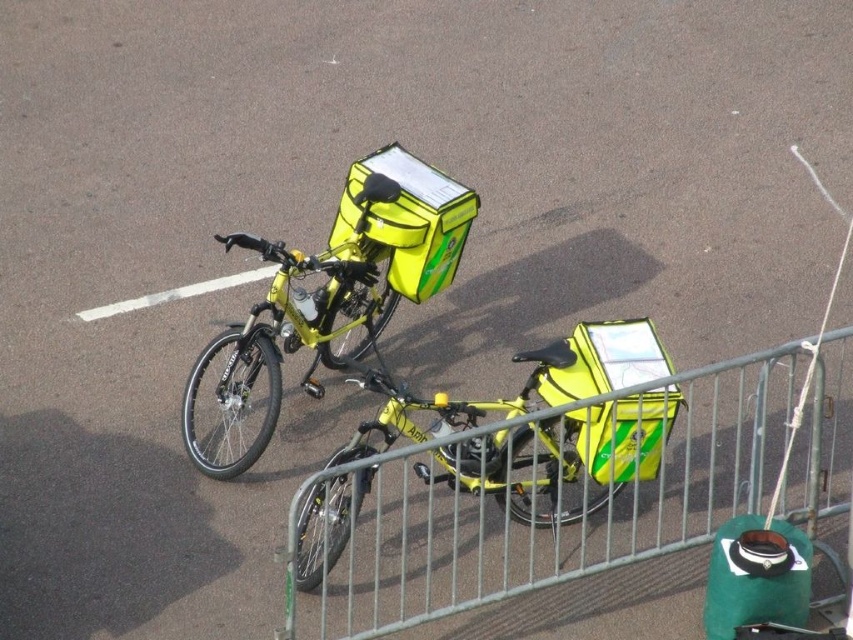
Between yellow matte bicycle at center and yellow matte bicycle at upper left, which one has more height?

yellow matte bicycle at upper left

Who is positioned more to the left, yellow matte bicycle at center or yellow matte bicycle at upper left?

From the viewer's perspective, yellow matte bicycle at upper left appears more on the left side.

What do you see at coordinates (563, 456) in the screenshot? I see `yellow matte bicycle at center` at bounding box center [563, 456].

Locate an element on the screen. Image resolution: width=853 pixels, height=640 pixels. yellow matte bicycle at center is located at coordinates (563, 456).